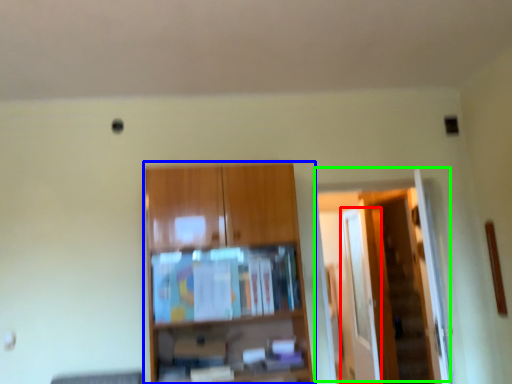
Question: Which object is the closest to the glass door (highlighted by a red box)? Choose among these: cupboard (highlighted by a blue box) or door (highlighted by a green box).

Choices:
 (A) cupboard
 (B) door

Answer: (B)